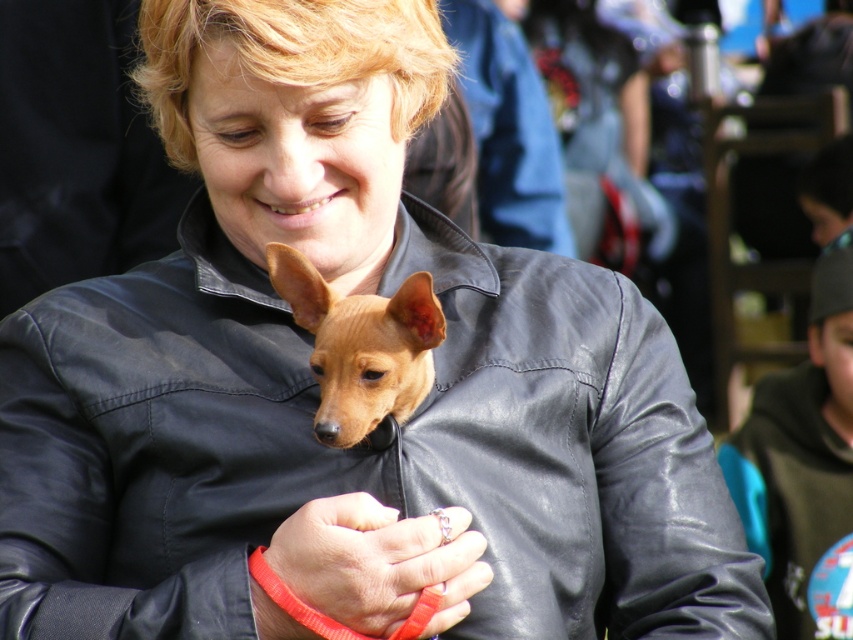
Question: Which point is closer to the camera?

Choices:
 (A) (815, 381)
 (B) (403, 380)
 (C) (351, 492)

Answer: (B)

Question: Is dark green hoodie at lower right below leather ring at center?

Choices:
 (A) yes
 (B) no

Answer: (A)

Question: Does dark green hoodie at lower right have a lesser width compared to leather ring at center?

Choices:
 (A) no
 (B) yes

Answer: (A)

Question: Is leather ring at center positioned before brown leather dog at center?

Choices:
 (A) no
 (B) yes

Answer: (A)

Question: Which point is closer to the camera taking this photo?

Choices:
 (A) (834, 353)
 (B) (308, 268)
 (C) (341, 515)

Answer: (C)

Question: Which point is closer to the camera?

Choices:
 (A) (285, 292)
 (B) (753, 545)
 (C) (387, 588)

Answer: (C)